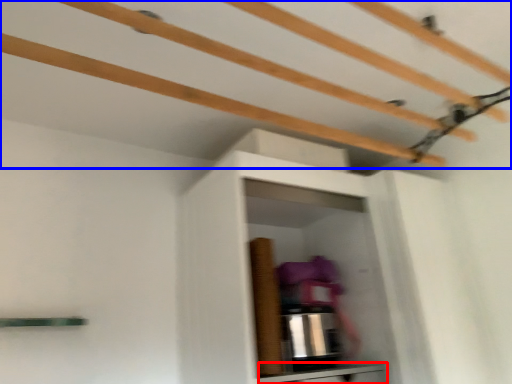
Question: Which point is closer to the camera, cabinetry (highlighted by a red box) or shelf (highlighted by a blue box)?

Choices:
 (A) cabinetry
 (B) shelf

Answer: (B)